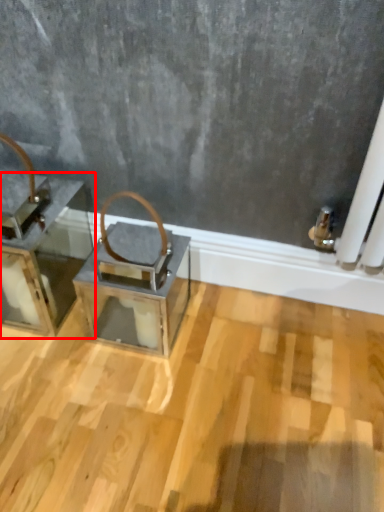
Question: From the image's perspective, what is the correct spatial positioning of furniture (annotated by the red box) in reference to table?

Choices:
 (A) below
 (B) above

Answer: (B)